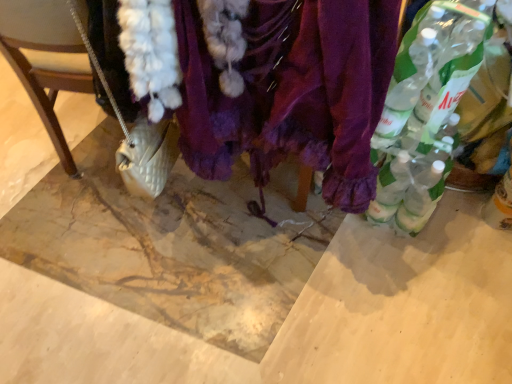
Question: Can you confirm if purple velvet scarf at center is smaller than white quilted purse at lower left?

Choices:
 (A) no
 (B) yes

Answer: (A)

Question: Could you tell me if purple velvet scarf at center is facing white quilted purse at lower left?

Choices:
 (A) yes
 (B) no

Answer: (B)

Question: Can you confirm if purple velvet scarf at center is shorter than white quilted purse at lower left?

Choices:
 (A) no
 (B) yes

Answer: (A)

Question: Is purple velvet scarf at center wider than white quilted purse at lower left?

Choices:
 (A) no
 (B) yes

Answer: (B)

Question: Is purple velvet scarf at center positioned in front of white quilted purse at lower left?

Choices:
 (A) yes
 (B) no

Answer: (A)

Question: Considering the relative sizes of purple velvet scarf at center and white quilted purse at lower left in the image provided, is purple velvet scarf at center thinner than white quilted purse at lower left?

Choices:
 (A) yes
 (B) no

Answer: (B)

Question: Is translucent plastic bottle at lower right, the first bottle from the right, bigger than purple velvet scarf at center?

Choices:
 (A) yes
 (B) no

Answer: (B)

Question: From a real-world perspective, is translucent plastic bottle at lower right, the first bottle from the right, positioned under purple velvet scarf at center based on gravity?

Choices:
 (A) no
 (B) yes

Answer: (B)

Question: Can you confirm if translucent plastic bottle at lower right, placed as the third bottle when sorted from left to right, is taller than purple velvet scarf at center?

Choices:
 (A) no
 (B) yes

Answer: (A)

Question: From the image's perspective, is translucent plastic bottle at lower right, the first bottle from the right, above purple velvet scarf at center?

Choices:
 (A) yes
 (B) no

Answer: (B)

Question: Is translucent plastic bottle at lower right, the first bottle from the right, far from purple velvet scarf at center?

Choices:
 (A) yes
 (B) no

Answer: (B)

Question: Is translucent plastic bottle at lower right, the first bottle from the right, not inside purple velvet scarf at center?

Choices:
 (A) no
 (B) yes

Answer: (B)

Question: Is the surface of purple velvet scarf at center in direct contact with clear plastic bottles at right, acting as the 1th bottle starting from the left?

Choices:
 (A) yes
 (B) no

Answer: (B)